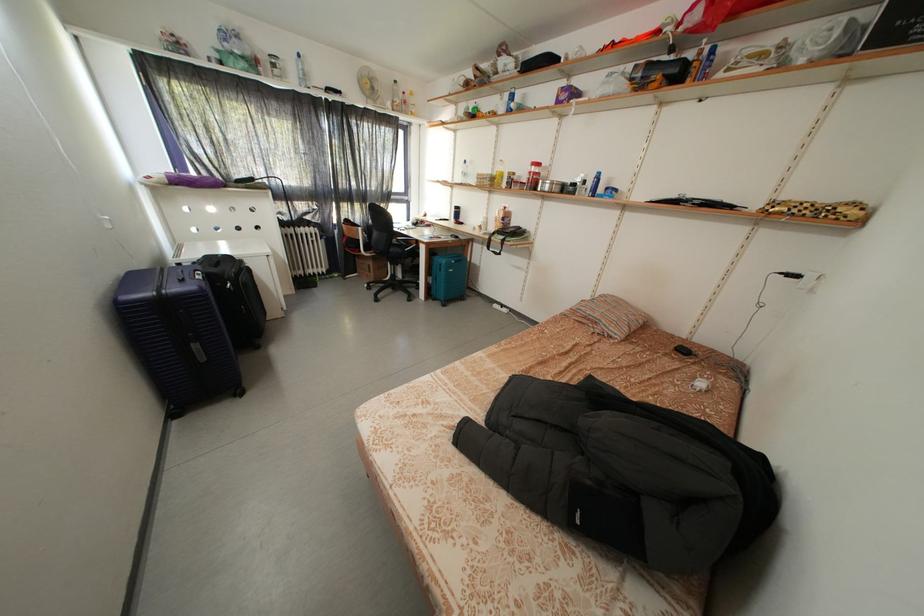
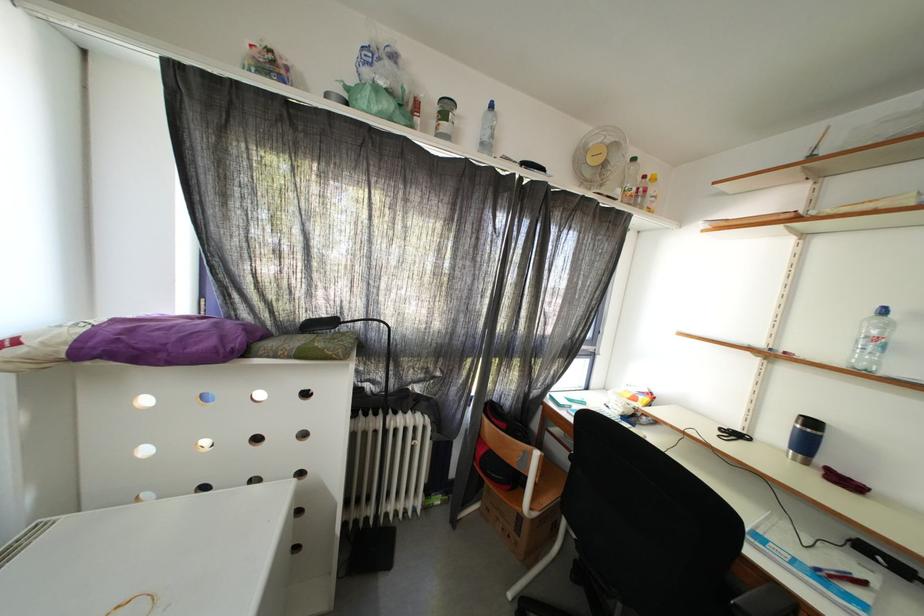
Find the pixel in the second image that matches [465,213] in the first image.

(820, 429)